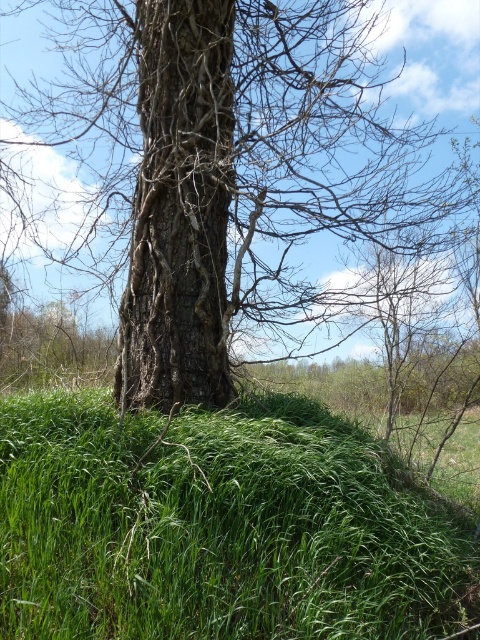
You are standing in front of the large tree trunk at its center. You notice two points marked on the tree trunk at coordinates point (336,285) and point (182,166). Which point is closer to you?

Point (336,285) is further to the viewer than point (182,166), so the point closer to you is point (182,166).

Looking at this image, you are a gardener planning to plant flowers between the green grassy mound at lower left and the brown rough bark tree trunk at center. Based on their positions, which object should you place the flowers closer to to ensure they receive adequate sunlight?

The green grassy mound at lower left is in front of the brown rough bark tree trunk at center, so placing flowers closer to the green grassy mound at lower left would ensure they receive more sunlight since it is not blocked by the tree trunk.

You are standing at the point marked by the coordinates point [228,173] in the image. What type of tree trunk are you facing?

The point [228,173] marks smooth bark tree at center, so you are facing a smooth bark tree trunk at center.